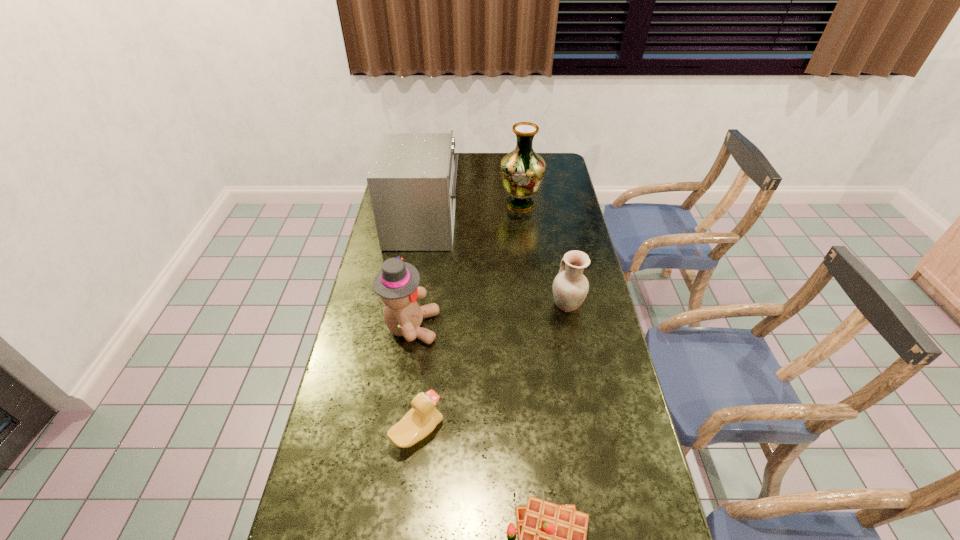
Locate an element on the screen. Image resolution: width=960 pixels, height=540 pixels. vacant region that satisfies the following two spatial constraints: 1. on the front panel of the pottery; 2. on the left side of the toaster oven is located at coordinates (411, 304).